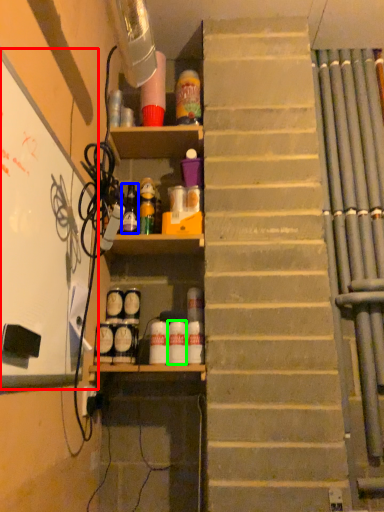
Question: Which is farther away from bulletin board (highlighted by a red box)? bottle (highlighted by a blue box) or bottle (highlighted by a green box)?

Choices:
 (A) bottle
 (B) bottle

Answer: (B)